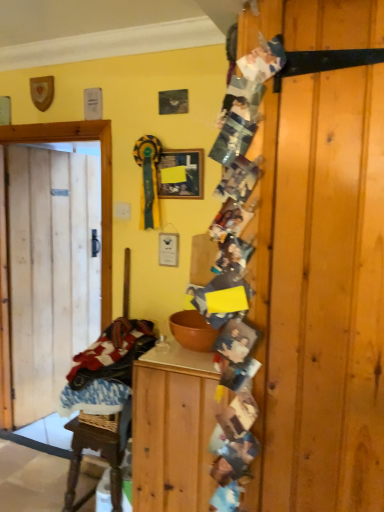
Where is `natural wood door at left`? Image resolution: width=384 pixels, height=512 pixels. natural wood door at left is located at coordinates (101, 180).

What is the approximate height of natural wood door at left?

natural wood door at left is 1.87 meters in height.

The height and width of the screenshot is (512, 384). In order to click on matte black picture frame at upper center in this screenshot , I will do `click(181, 174)`.

What do you see at coordinates (106, 369) in the screenshot? The height and width of the screenshot is (512, 384). I see `plaid fabric laundry at left` at bounding box center [106, 369].

Identify the location of natural wood door at left. Image resolution: width=384 pixels, height=512 pixels. (101, 180).

Is matte black picture frame at upper center not inside wooden cabinet at center?

matte black picture frame at upper center lies outside wooden cabinet at center's area.

From a real-world perspective, is matte black picture frame at upper center physically above wooden cabinet at center?

Correct, in the physical world, matte black picture frame at upper center is higher than wooden cabinet at center.

Which is more to the right, matte black picture frame at upper center or wooden cabinet at center?

wooden cabinet at center.

How distant is matte black picture frame at upper center from wooden cabinet at center?

3.34 feet.

From a real-world perspective, which is physically below, plaid fabric laundry at left or matte black picture frame at upper center?

plaid fabric laundry at left is physically lower.

Considering the sizes of objects plaid fabric laundry at left and matte black picture frame at upper center in the image provided, who is shorter, plaid fabric laundry at left or matte black picture frame at upper center?

Standing shorter between the two is matte black picture frame at upper center.

Considering the positions of objects plaid fabric laundry at left and matte black picture frame at upper center in the image provided, who is more to the right, plaid fabric laundry at left or matte black picture frame at upper center?

matte black picture frame at upper center is more to the right.

From the image's perspective, is plaid fabric laundry at left below matte black picture frame at upper center?

Correct, plaid fabric laundry at left appears lower than matte black picture frame at upper center in the image.

Image resolution: width=384 pixels, height=512 pixels. What are the coordinates of `cabinetry lying below the plaid fabric laundry at left (from the image's perspective)` in the screenshot? It's located at (172, 430).

Is plaid fabric laundry at left a part of wooden cabinet at center?

No, plaid fabric laundry at left is located outside of wooden cabinet at center.

From a real-world perspective, is wooden cabinet at center over plaid fabric laundry at left?

No, from a real-world perspective, wooden cabinet at center is not on top of plaid fabric laundry at left.

Which object is more forward, wooden cabinet at center or plaid fabric laundry at left?

wooden cabinet at center is more forward.

Which is closer, (92,379) or (77,121)?

Point (92,379) appears to be closer to the viewer than point (77,121).

Considering the sizes of objects plaid fabric laundry at left and natural wood door at left in the image provided, who is taller, plaid fabric laundry at left or natural wood door at left?

natural wood door at left.

From the image's perspective, between plaid fabric laundry at left and natural wood door at left, who is located below?

From the image's view, plaid fabric laundry at left is below.

Is plaid fabric laundry at left to the left of natural wood door at left from the viewer's perspective?

Incorrect, plaid fabric laundry at left is not on the left side of natural wood door at left.

From the picture: From the image's perspective, between natural wood door at left and matte black picture frame at upper center, which one is located above?

From the image's view, matte black picture frame at upper center is above.

Does natural wood door at left turn towards matte black picture frame at upper center?

Yes, natural wood door at left is facing matte black picture frame at upper center.

Is natural wood door at left not close to matte black picture frame at upper center?

Actually, natural wood door at left and matte black picture frame at upper center are a little close together.

From a real-world perspective, which object stands above the other?

In real-world perspective, matte black picture frame at upper center is above.

From a real-world perspective, which object rests below the other?

wooden cabinet at center.

Is wooden cabinet at center facing towards natural wood door at left?

No.

Does wooden cabinet at center have a lesser height compared to natural wood door at left?

Correct, wooden cabinet at center is not as tall as natural wood door at left.

Is the depth of wooden cabinet at center less than that of natural wood door at left?

That is True.

Do you think natural wood door at left is within wooden cabinet at center, or outside of it?

natural wood door at left cannot be found inside wooden cabinet at center.

From the picture: Considering the relative positions of natural wood door at left and wooden cabinet at center in the image provided, is natural wood door at left in front of wooden cabinet at center?

No, natural wood door at left is further to the viewer.

From a real-world perspective, is natural wood door at left on wooden cabinet at center?

Yes, from a real-world perspective, natural wood door at left is above wooden cabinet at center.

I want to click on cabinetry below the matte black picture frame at upper center (from the image's perspective), so click(172, 430).

You are a GUI agent. You are given a task and a screenshot of the screen. Output one action in this format:
    pyautogui.click(x=<x>, y=<y>)
    Task: Click on the picture frame above the plaid fabric laundry at left (from a real-world perspective)
    
    Given the screenshot: What is the action you would take?
    pyautogui.click(x=181, y=174)

Considering their positions, is plaid fabric laundry at left positioned further to matte black picture frame at upper center than natural wood door at left?

plaid fabric laundry at left is positioned further to the anchor matte black picture frame at upper center.

Based on their spatial positions, is natural wood door at left or wooden cabinet at center further from matte black picture frame at upper center?

wooden cabinet at center.

Looking at the image, which one is located closer to natural wood door at left, wooden cabinet at center or matte black picture frame at upper center?

matte black picture frame at upper center is closer to natural wood door at left.

Which object lies nearer to the anchor point wooden cabinet at center, plaid fabric laundry at left or matte black picture frame at upper center?

Among the two, plaid fabric laundry at left is located nearer to wooden cabinet at center.

From the image, which object appears to be nearer to plaid fabric laundry at left, natural wood door at left or wooden cabinet at center?

Based on the image, wooden cabinet at center appears to be nearer to plaid fabric laundry at left.

Consider the image. Estimate the real-world distances between objects in this image. Which object is closer to wooden cabinet at center, natural wood door at left or matte black picture frame at upper center?

natural wood door at left is positioned closer to the anchor wooden cabinet at center.

Looking at the image, which one is located closer to plaid fabric laundry at left, matte black picture frame at upper center or wooden cabinet at center?

wooden cabinet at center is closer to plaid fabric laundry at left.

From the image, which object appears to be farther from plaid fabric laundry at left, wooden cabinet at center or natural wood door at left?

natural wood door at left is further to plaid fabric laundry at left.

The height and width of the screenshot is (512, 384). I want to click on laundry that lies between matte black picture frame at upper center and wooden cabinet at center from top to bottom, so pyautogui.click(x=106, y=369).

Where is `laundry between wooden cabinet at center and natural wood door at left along the z-axis`? This screenshot has height=512, width=384. laundry between wooden cabinet at center and natural wood door at left along the z-axis is located at coordinates (106, 369).

Find the location of a particular element. This screenshot has width=384, height=512. picture frame located between plaid fabric laundry at left and natural wood door at left in the depth direction is located at coordinates (181, 174).

This screenshot has height=512, width=384. I want to click on door between matte black picture frame at upper center and wooden cabinet at center in the up-down direction, so click(x=101, y=180).